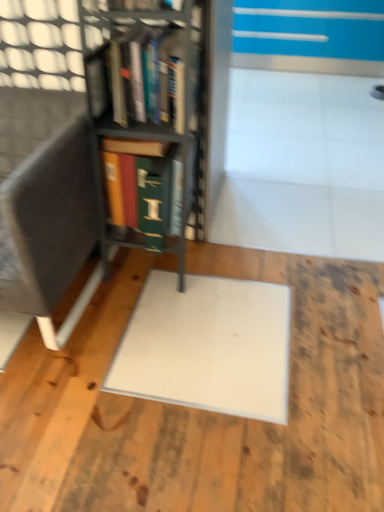
Question: Does dark gray fabric armchair at left have a lesser width compared to green matte book at center, positioned as the first book in bottom-to-top order?

Choices:
 (A) no
 (B) yes

Answer: (A)

Question: Considering the relative sizes of dark gray fabric armchair at left and green matte book at center, the second book viewed from the top, in the image provided, is dark gray fabric armchair at left shorter than green matte book at center, the second book viewed from the top,?

Choices:
 (A) yes
 (B) no

Answer: (B)

Question: Is dark gray fabric armchair at left outside green matte book at center, positioned as the first book in bottom-to-top order?

Choices:
 (A) yes
 (B) no

Answer: (A)

Question: Considering the relative sizes of dark gray fabric armchair at left and green matte book at center, the second book viewed from the top, in the image provided, is dark gray fabric armchair at left smaller than green matte book at center, the second book viewed from the top,?

Choices:
 (A) no
 (B) yes

Answer: (A)

Question: From a real-world perspective, is dark gray fabric armchair at left on green matte book at center, positioned as the first book in bottom-to-top order?

Choices:
 (A) no
 (B) yes

Answer: (A)

Question: From the image's perspective, is dark gray fabric armchair at left beneath green matte book at center, positioned as the first book in bottom-to-top order?

Choices:
 (A) yes
 (B) no

Answer: (A)

Question: Can you confirm if green matte book at center, the second book viewed from the top, is shorter than white matte wood at center?

Choices:
 (A) yes
 (B) no

Answer: (B)

Question: Is green matte book at center, positioned as the first book in bottom-to-top order, surrounding white matte wood at center?

Choices:
 (A) no
 (B) yes

Answer: (A)

Question: From the image's perspective, is green matte book at center, positioned as the first book in bottom-to-top order, over white matte wood at center?

Choices:
 (A) no
 (B) yes

Answer: (B)

Question: Does green matte book at center, the second book viewed from the top, lie behind white matte wood at center?

Choices:
 (A) yes
 (B) no

Answer: (A)

Question: Is green matte book at center, positioned as the first book in bottom-to-top order, smaller than white matte wood at center?

Choices:
 (A) yes
 (B) no

Answer: (A)

Question: Considering the relative sizes of green matte book at center, positioned as the first book in bottom-to-top order, and white matte wood at center in the image provided, is green matte book at center, positioned as the first book in bottom-to-top order, thinner than white matte wood at center?

Choices:
 (A) no
 (B) yes

Answer: (B)

Question: Is hardcover books at center, the second book from the bottom, looking in the opposite direction of white matte wood at center?

Choices:
 (A) yes
 (B) no

Answer: (B)